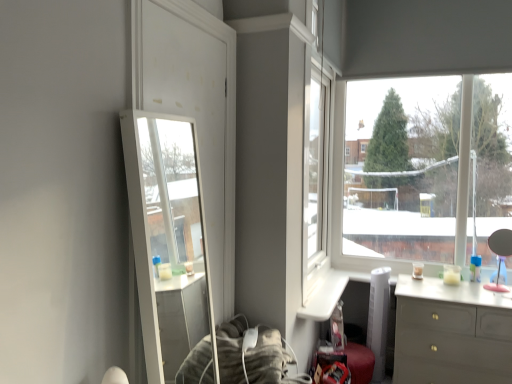
At what (x,y) coordinates should I click in order to perform the action: click on matte gray dresser at lower right. Please return your answer as a coordinate pair (x, y). Looking at the image, I should click on (451, 334).

The image size is (512, 384). In order to click on the chest of drawers that is under the clear glass mirror at left (from a real-world perspective) in this screenshot , I will do 451,334.

From the picture: Could you tell me if clear glass mirror at left is facing matte gray dresser at lower right?

No, clear glass mirror at left does not turn towards matte gray dresser at lower right.

Which object is closer to the camera, clear glass mirror at left or matte gray dresser at lower right?

clear glass mirror at left is in front.

Who is taller, clear glass mirror at left or matte gray dresser at lower right?

With more height is clear glass mirror at left.

Would you say clear glass mirror at left is a long distance from transparent glass window at upper right?

Absolutely, clear glass mirror at left is distant from transparent glass window at upper right.

Which of these two, clear glass mirror at left or transparent glass window at upper right, stands taller?

clear glass mirror at left is taller.

From a real-world perspective, between clear glass mirror at left and transparent glass window at upper right, who is vertically higher?

transparent glass window at upper right, from a real-world perspective.

Is clear glass mirror at left closer to camera compared to transparent glass window at upper right?

Yes.

Is point (411, 329) closer or farther from the camera than point (484, 252)?

Point (411, 329) appears to be closer to the viewer than point (484, 252).

Is matte gray dresser at lower right to the right of transparent glass window at upper right from the viewer's perspective?

Correct, you'll find matte gray dresser at lower right to the right of transparent glass window at upper right.

Between matte gray dresser at lower right and transparent glass window at upper right, which one has smaller width?

transparent glass window at upper right is thinner.

From a real-world perspective, between matte gray dresser at lower right and transparent glass window at upper right, who is vertically higher?

transparent glass window at upper right is physically above.

Who is smaller, transparent glass window at upper right or matte gray dresser at lower right?

transparent glass window at upper right.

This screenshot has height=384, width=512. I want to click on window lying behind the matte gray dresser at lower right, so click(426, 168).

Between transparent glass window at upper right and matte gray dresser at lower right, which one appears on the right side from the viewer's perspective?

matte gray dresser at lower right.

Between transparent glass window at upper right and matte gray dresser at lower right, which one has larger width?

With larger width is matte gray dresser at lower right.

Considering the sizes of objects matte gray dresser at lower right and clear glass mirror at left in the image provided, who is taller, matte gray dresser at lower right or clear glass mirror at left?

With more height is clear glass mirror at left.

Would you consider matte gray dresser at lower right to be distant from clear glass mirror at left?

Yes, matte gray dresser at lower right and clear glass mirror at left are located far from each other.

Is clear glass mirror at left located within matte gray dresser at lower right?

No.

Is matte gray dresser at lower right facing away from clear glass mirror at left?

No, matte gray dresser at lower right is not facing the opposite direction of clear glass mirror at left.

Could you tell me if transparent glass window at upper right is facing clear glass mirror at left?

Yes, transparent glass window at upper right faces towards clear glass mirror at left.

Consider the image. Which of these two, transparent glass window at upper right or clear glass mirror at left, is bigger?

transparent glass window at upper right is bigger.

How many degrees apart are the facing directions of transparent glass window at upper right and clear glass mirror at left?

The facing directions of transparent glass window at upper right and clear glass mirror at left are 91.1 degrees apart.

Considering the positions of objects transparent glass window at upper right and clear glass mirror at left in the image provided, who is behind, transparent glass window at upper right or clear glass mirror at left?

transparent glass window at upper right is further from the camera.

Identify the location of glass door on the left side of matte gray dresser at lower right. (194, 110).

The image size is (512, 384). What are the coordinates of `glass door located underneath the transparent glass window at upper right (from a real-world perspective)` in the screenshot? It's located at (194, 110).

From the image, which object appears to be farther from matte gray dresser at lower right, clear glass mirror at left or transparent glass window at upper right?

clear glass mirror at left.

When comparing their distances from transparent glass window at upper right, does matte gray dresser at lower right or clear glass mirror at left seem closer?

matte gray dresser at lower right is positioned closer to the anchor transparent glass window at upper right.

Based on their spatial positions, is matte gray dresser at lower right or transparent glass window at upper right further from clear glass mirror at left?

transparent glass window at upper right is positioned further to the anchor clear glass mirror at left.

Which object lies nearer to the anchor point transparent glass window at upper right, clear glass mirror at left or matte gray dresser at lower right?

matte gray dresser at lower right is positioned closer to the anchor transparent glass window at upper right.

From the picture: Which object lies further to the anchor point matte gray dresser at lower right, transparent glass window at upper right or clear glass mirror at left?

The object further to matte gray dresser at lower right is clear glass mirror at left.

Considering their positions, is transparent glass window at upper right positioned further to clear glass mirror at left than matte gray dresser at lower right?

transparent glass window at upper right is further to clear glass mirror at left.

The image size is (512, 384). I want to click on window situated between clear glass mirror at left and matte gray dresser at lower right from left to right, so (426, 168).